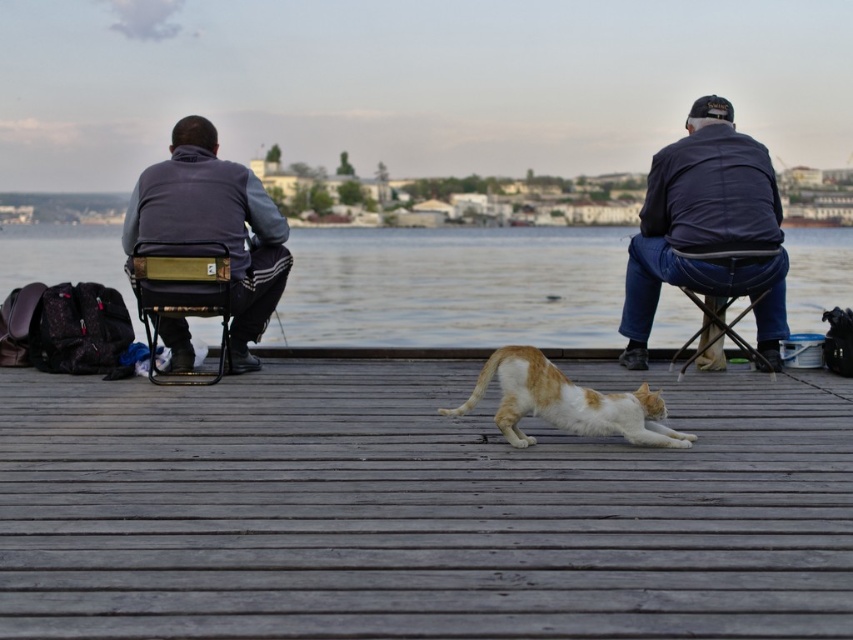
Question: Which point is farther from the camera taking this photo?

Choices:
 (A) (677, 170)
 (B) (193, 292)
 (C) (630, 396)
 (D) (340, 273)

Answer: (D)

Question: Which is farther from the metallic folding chair at right?

Choices:
 (A) orange-white fur cat at center
 (B) dark blue denim jacket at upper right
 (C) wooden dock at center
 (D) metallic gold chair at left

Answer: (A)

Question: Which point appears closest to the camera in this image?

Choices:
 (A) (622, 432)
 (B) (711, 134)
 (C) (239, 444)

Answer: (A)

Question: Is dark blue denim jacket at upper right positioned at the back of orange-white fur cat at center?

Choices:
 (A) no
 (B) yes

Answer: (B)

Question: From the image, what is the correct spatial relationship of dark blue denim jacket at upper right in relation to matte gray jacket at left?

Choices:
 (A) right
 (B) left

Answer: (A)

Question: Is orange-white fur cat at center to the left of metallic gold chair at left from the viewer's perspective?

Choices:
 (A) yes
 (B) no

Answer: (B)